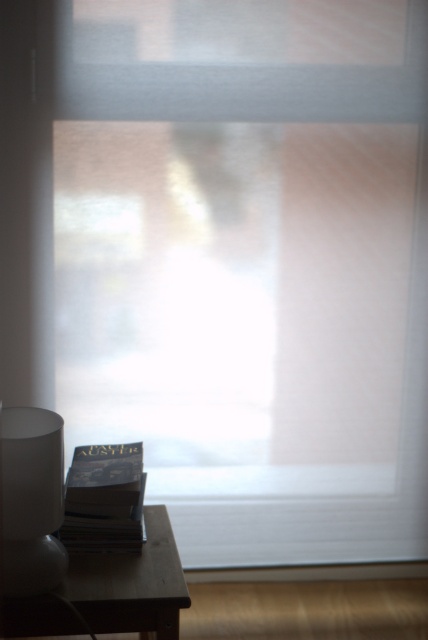
You are organizing a small reading nook in the corner of the room. You have a wooden table at lower left and a matte black book at lower left. Which object should you move first to create space for a new armchair?

You should move the wooden table at lower left first because it is in front of the matte black book at lower left, meaning it is closer to you and easier to access to make space for the armchair.

You are standing in the room and want to place a small vase on the wooden table at lower left. However, there is a white frosted glass lamp at lower left above it. Will the lamp block access to the table?

The wooden table at lower left is located below the white frosted glass lamp at lower left, so the lamp is above the table. This means the lamp might block direct access to the table from above, but you can still reach the table from the sides or front where there is no obstruction.

You are trying to place a new plant pot that is 10 inches tall next to the white frosted glass lamp at lower left and the matte black book at lower left. Considering their heights, which object will the plant pot be taller than?

The white frosted glass lamp at lower left is much taller than the matte black book at lower left. Since the plant pot is 10 inches tall, it will be taller than the matte black book at lower left but shorter than the white frosted glass lamp at lower left.